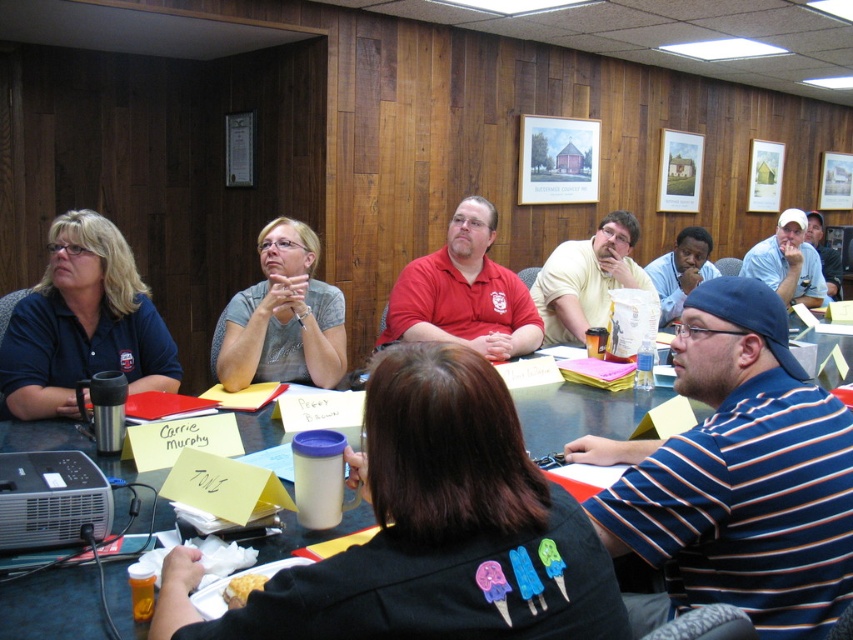
Based on the photo, is blue striped shirt at center smaller than matte blue shirt at left?

Correct, blue striped shirt at center occupies less space than matte blue shirt at left.

Can you confirm if blue striped shirt at center is thinner than matte blue shirt at left?

In fact, blue striped shirt at center might be wider than matte blue shirt at left.

Between point (761, 472) and point (6, 392), which one is positioned in front?

Point (761, 472) is more forward.

At what (x,y) coordinates should I click in order to perform the action: click on blue striped shirt at center. Please return your answer as a coordinate pair (x, y). Looking at the image, I should click on (738, 474).

Is matte red shirt at center thinner than white cap at upper right?

No, matte red shirt at center is not thinner than white cap at upper right.

Can you confirm if matte red shirt at center is positioned to the right of white cap at upper right?

Incorrect, matte red shirt at center is not on the right side of white cap at upper right.

What do you see at coordinates (463, 292) in the screenshot?
I see `matte red shirt at center` at bounding box center [463, 292].

This screenshot has width=853, height=640. Find the location of `matte red shirt at center`. matte red shirt at center is located at coordinates (463, 292).

Is black plastic table at center positioned in front of white cap at upper right?

Yes, black plastic table at center is closer to the viewer.

Which is in front, point (38, 600) or point (781, 256)?

Point (38, 600)

Is point (49, 445) less distant than point (759, 272)?

Yes, point (49, 445) is in front of point (759, 272).

Identify the location of black plastic table at center. The width and height of the screenshot is (853, 640). (51, 605).